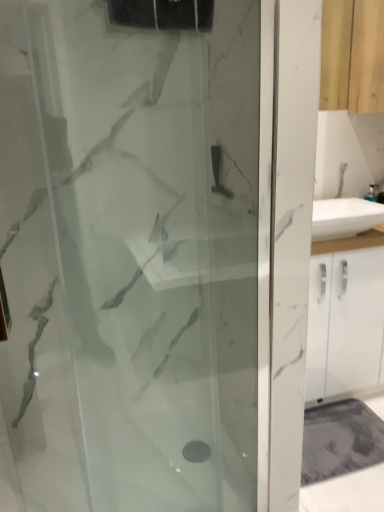
Locate an element on the screen. The height and width of the screenshot is (512, 384). transparent glass shower door at center is located at coordinates (156, 244).

Based on the photo, measure the distance between transparent glass shower door at center and camera.

They are 35.72 inches apart.

The width and height of the screenshot is (384, 512). What do you see at coordinates (156, 244) in the screenshot?
I see `transparent glass shower door at center` at bounding box center [156, 244].

I want to click on transparent glass shower door at center, so click(156, 244).